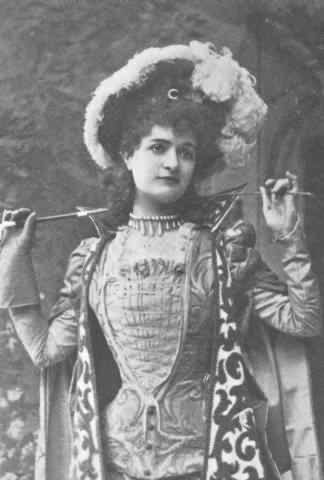
Where is `robe`? robe is located at coordinates (229, 400).